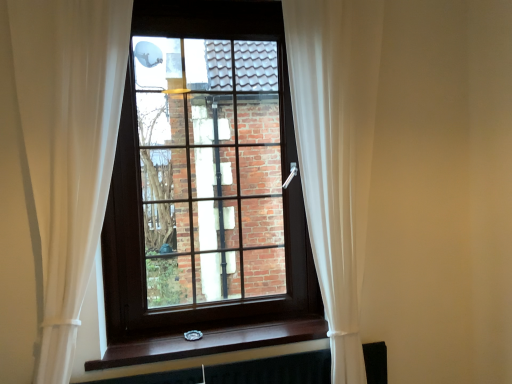
Question: Is white sheer curtain at center, acting as the first curtain starting from the left, shorter than black matte radiator at bottom?

Choices:
 (A) no
 (B) yes

Answer: (A)

Question: From the image's perspective, is white sheer curtain at center, which ranks as the second curtain in right-to-left order, located beneath black matte radiator at bottom?

Choices:
 (A) no
 (B) yes

Answer: (A)

Question: Is white sheer curtain at center, acting as the first curtain starting from the left, facing away from black matte radiator at bottom?

Choices:
 (A) no
 (B) yes

Answer: (A)

Question: From a real-world perspective, is white sheer curtain at center, acting as the first curtain starting from the left, over black matte radiator at bottom?

Choices:
 (A) yes
 (B) no

Answer: (A)

Question: Can black matte radiator at bottom be found inside white sheer curtain at center, which ranks as the second curtain in right-to-left order?

Choices:
 (A) no
 (B) yes

Answer: (A)

Question: Is black matte radiator at bottom spatially inside brown wood at lower center, or outside of it?

Choices:
 (A) outside
 (B) inside

Answer: (A)

Question: Does point (386, 359) appear closer or farther from the camera than point (205, 334)?

Choices:
 (A) farther
 (B) closer

Answer: (A)

Question: From a real-world perspective, relative to brown wood at lower center, is black matte radiator at bottom vertically above or below?

Choices:
 (A) above
 (B) below

Answer: (B)

Question: Would you say black matte radiator at bottom is to the left or to the right of brown wood at lower center in the picture?

Choices:
 (A) right
 (B) left

Answer: (A)

Question: Is white sheer curtain at right, placed as the 1th curtain when sorted from right to left, to the left or to the right of brown wooden window at center in the image?

Choices:
 (A) left
 (B) right

Answer: (B)

Question: From the image's perspective, is white sheer curtain at right, the second curtain positioned from the left, positioned above or below brown wooden window at center?

Choices:
 (A) above
 (B) below

Answer: (B)

Question: Is white sheer curtain at right, placed as the 1th curtain when sorted from right to left, wider or thinner than brown wooden window at center?

Choices:
 (A) wide
 (B) thin

Answer: (A)

Question: Is point (340, 226) positioned closer to the camera than point (203, 286)?

Choices:
 (A) farther
 (B) closer

Answer: (B)

Question: In terms of width, does white sheer curtain at center, which ranks as the second curtain in right-to-left order, look wider or thinner when compared to brown wooden window at center?

Choices:
 (A) wide
 (B) thin

Answer: (A)

Question: Is white sheer curtain at center, which ranks as the second curtain in right-to-left order, taller or shorter than brown wooden window at center?

Choices:
 (A) tall
 (B) short

Answer: (A)